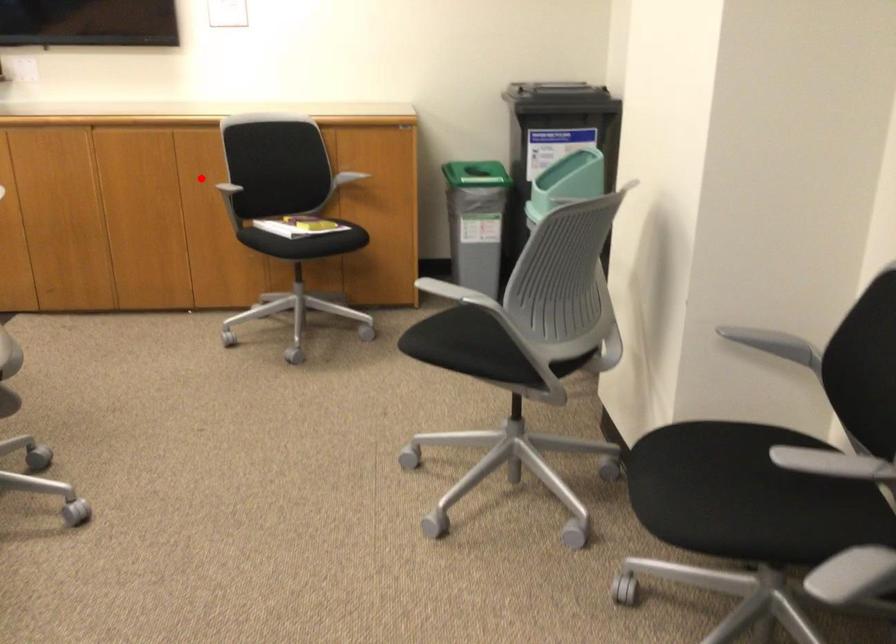
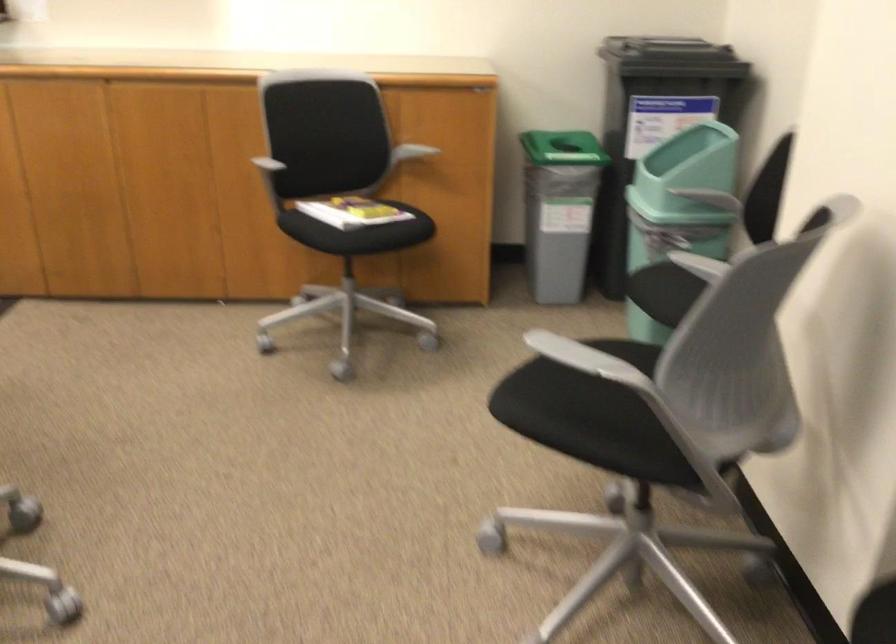
Find the pixel in the second image that matches the highlighted location in the first image.

(236, 149)